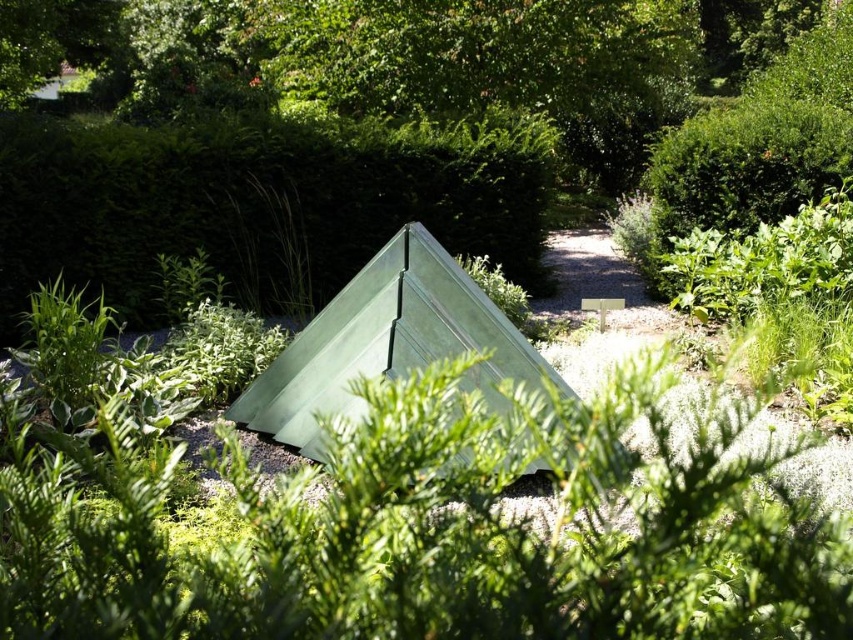
You are standing at point 0.0, 0.0 in the garden. Where is the green matte tent at center located relative to your position?

The green matte tent at center is located at point (254,204) relative to your position.